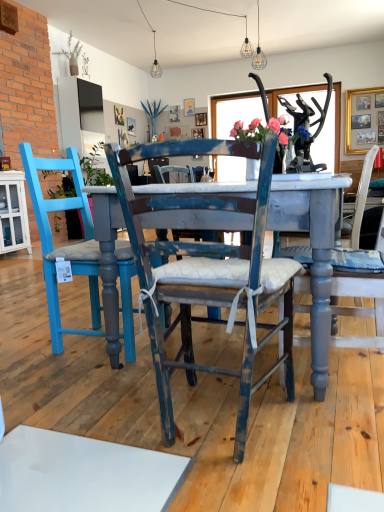
Question: Considering the positions of distressed blue chair at center, acting as the second chair starting from the left, and matte blue vase with pink roses at center in the image, is distressed blue chair at center, acting as the second chair starting from the left, wider or thinner than matte blue vase with pink roses at center?

Choices:
 (A) thin
 (B) wide

Answer: (B)

Question: Would you say distressed blue chair at center, acting as the second chair starting from the left, is to the left or to the right of matte blue vase with pink roses at center in the picture?

Choices:
 (A) right
 (B) left

Answer: (B)

Question: Estimate the real-world distances between objects in this image. Which object is farther from the gold-framed picture at upper right?

Choices:
 (A) distressed gray wood chair at center, which is the 3th chair in left-to-right order
 (B) matte blue vase with pink roses at center
 (C) distressed blue chair at center, which appears as the 2th chair when viewed from the right
 (D) blue painted wood chair at left, positioned as the 3th chair in right-to-left order

Answer: (C)

Question: Based on their relative distances, which object is nearer to the distressed gray wood chair at center, which is counted as the first chair, starting from the right?

Choices:
 (A) gold-framed picture at upper right
 (B) matte blue vase with pink roses at center
 (C) blue painted wood chair at left, the 1th chair positioned from the left
 (D) distressed blue chair at center, acting as the second chair starting from the left

Answer: (D)